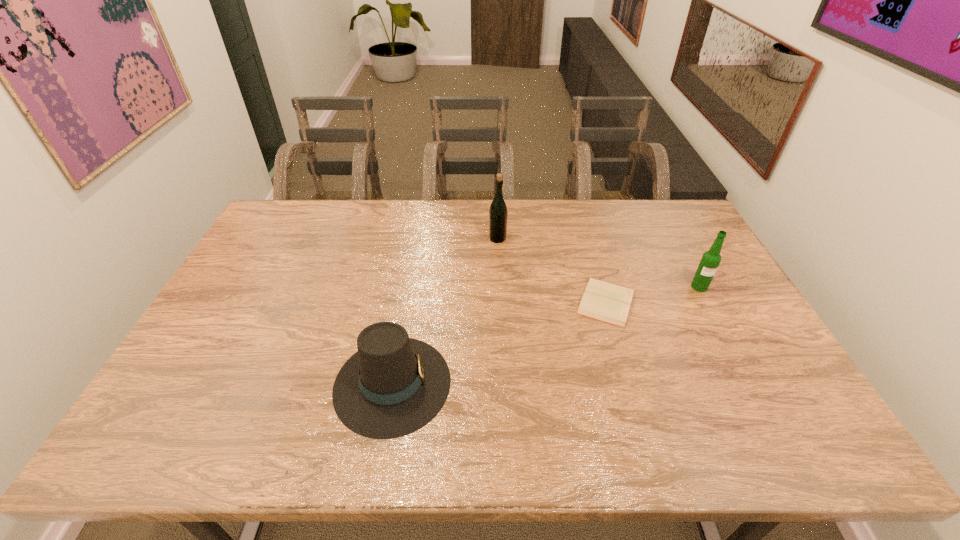
The width and height of the screenshot is (960, 540). I want to click on free space that is in between the hat and the nearer beer bottle, so click(x=546, y=335).

Locate an element on the screen. The image size is (960, 540). empty space between the second shortest object and the farther beer bottle is located at coordinates (444, 311).

Image resolution: width=960 pixels, height=540 pixels. Identify the location of vacant space that is in between the nearer beer bottle and the second shortest object. point(546,335).

Where is `vacant space in between the hat and the second object from right to left`? Image resolution: width=960 pixels, height=540 pixels. vacant space in between the hat and the second object from right to left is located at coordinates (499, 342).

Identify the location of vacant space that's between the second object from left to right and the shortest object. This screenshot has width=960, height=540. (552, 270).

Image resolution: width=960 pixels, height=540 pixels. Find the location of `free spot between the third tallest object and the nearer beer bottle`. free spot between the third tallest object and the nearer beer bottle is located at coordinates (546, 335).

Locate an element on the screen. Image resolution: width=960 pixels, height=540 pixels. free space between the taller beer bottle and the right beer bottle is located at coordinates (598, 263).

The width and height of the screenshot is (960, 540). In order to click on empty space between the right beer bottle and the shortest object in this screenshot , I will do `click(653, 294)`.

The width and height of the screenshot is (960, 540). I want to click on free spot between the nearer beer bottle and the left beer bottle, so click(598, 263).

The width and height of the screenshot is (960, 540). What are the coordinates of `free point between the farthest object and the nearest object` in the screenshot? It's located at (444, 311).